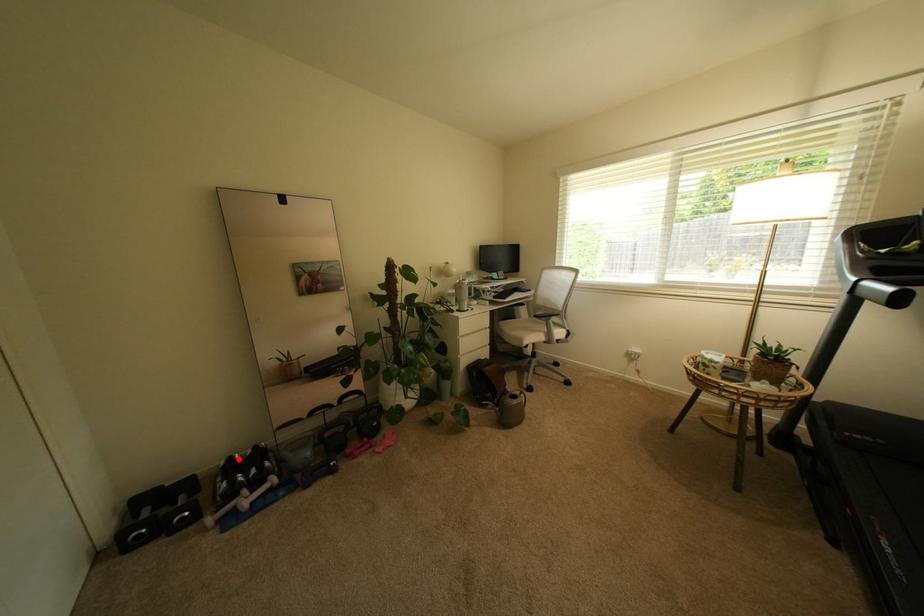
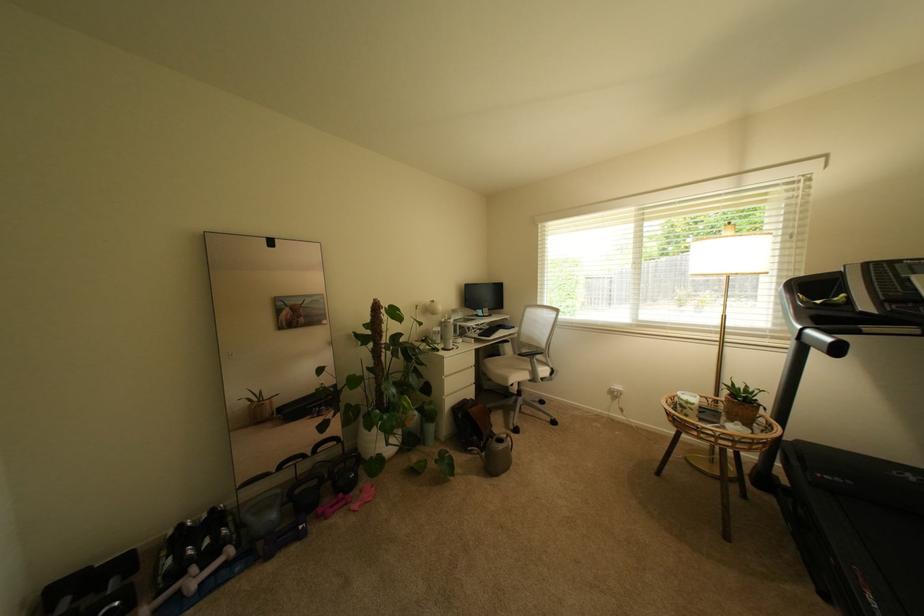
Question: I am providing you with two images of the same scene from different viewpoints. In image1, a red point is highlighted. Considering the same 3D point in image2, which of the following is correct?

Choices:
 (A) It is closer
 (B) It is farther

Answer: (A)